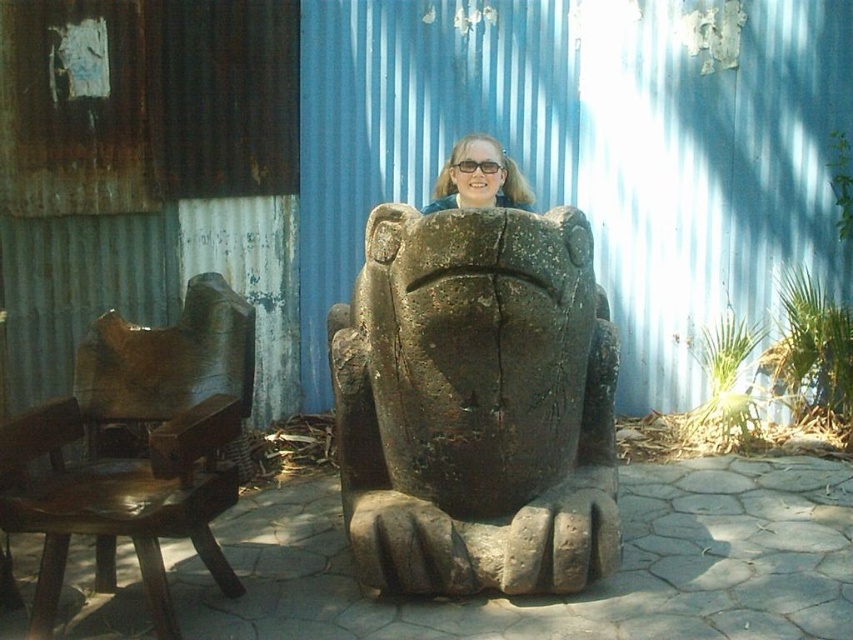
You are sitting on the brown polished wood chair at left and want to get a clear view of the matte brown stone statue at center. Which direction should you turn your head to look directly at the statue?

Since the brown polished wood chair at left is positioned on the left side of the matte brown stone statue at center, you should turn your head to the right to look directly at the statue.

You are standing in front of the stone sculpture of a frog. There are two points marked on the sculpture, one at coordinates point (599,349) and the other at point (503,195). Which point is closer to you?

Point (599,349) is closer to the viewer than point (503,195).

You are a painter standing at the base of the dark brown stone statue at center and want to sit down to rest. The brown polished wood chair at left is your only option. Can you reach the chair without moving the statue?

The dark brown stone statue at center is located above the brown polished wood chair at left, so you can reach the chair by moving around the statue or stepping down since it is positioned below the statue.